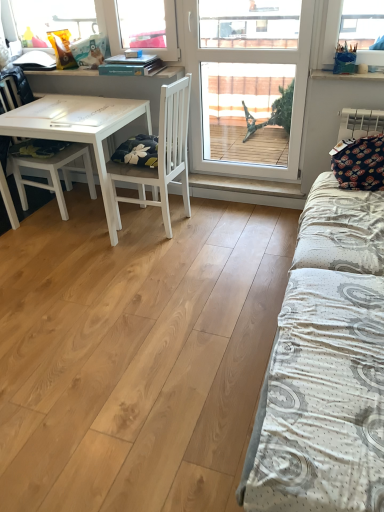
Find the location of a particular element. This screenshot has width=384, height=512. free space in front of white matte table at left is located at coordinates (84, 272).